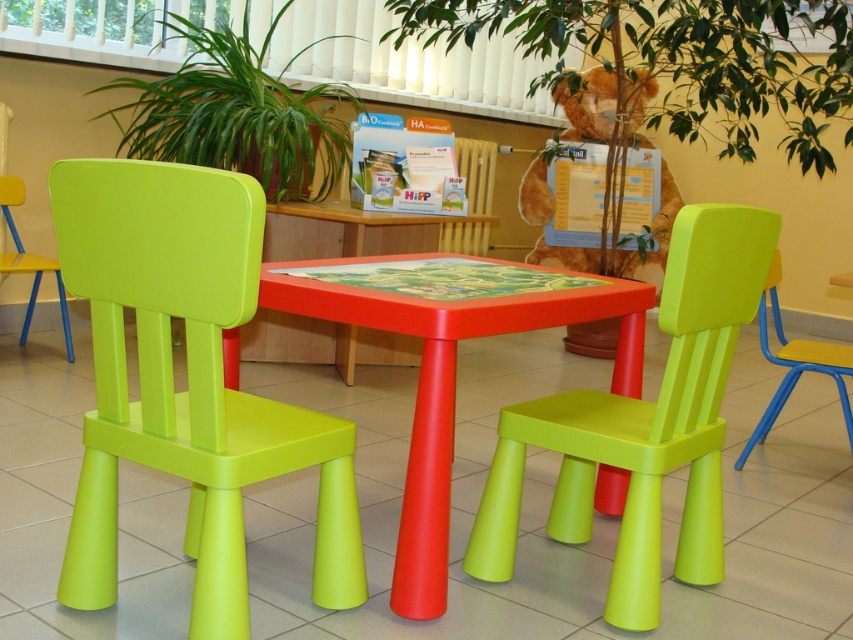
You are a parent trying to find a place to sit while your child plays at the lime matte plastic chair at center. There is a point marked at coordinates (187, 384). Where is this point located?

The point at coordinates (187, 384) corresponds to the lime matte plastic chair at center.